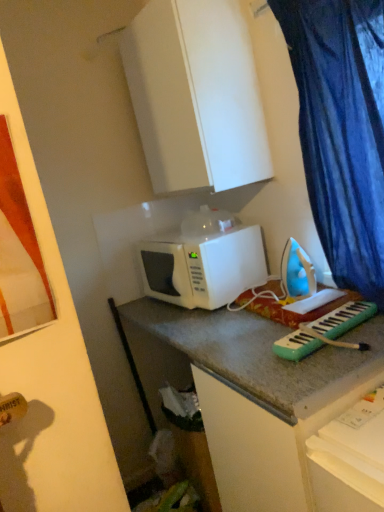
What are the coordinates of `white matte cabinet at upper center` in the screenshot? It's located at (196, 95).

This screenshot has width=384, height=512. Describe the element at coordinates (203, 267) in the screenshot. I see `white matte microwave at center` at that location.

This screenshot has width=384, height=512. Find the location of `white matte microwave at center`. white matte microwave at center is located at coordinates (203, 267).

Where is `blue fabric curtain at right`? The width and height of the screenshot is (384, 512). blue fabric curtain at right is located at coordinates (342, 130).

Locate an element on the screen. This screenshot has width=384, height=512. white matte cabinet at upper center is located at coordinates (196, 95).

Does white matte microwave at center contain blue fabric curtain at right?

No, white matte microwave at center does not contain blue fabric curtain at right.

Between white matte microwave at center and blue fabric curtain at right, which one has larger size?

With larger size is blue fabric curtain at right.

Between white matte microwave at center and blue fabric curtain at right, which one has larger width?

With larger width is white matte microwave at center.

From a real-world perspective, which is physically below, blue fabric curtain at right or white matte microwave at center?

white matte microwave at center, from a real-world perspective.

What's the angular difference between blue fabric curtain at right and white matte microwave at center's facing directions?

8.33 degrees.

Does blue fabric curtain at right have a smaller size compared to white matte microwave at center?

Actually, blue fabric curtain at right might be larger than white matte microwave at center.

Considering the sizes of objects blue fabric curtain at right and white matte microwave at center in the image provided, who is taller, blue fabric curtain at right or white matte microwave at center?

Standing taller between the two is blue fabric curtain at right.

Can you confirm if green plastic keyboard at center-right is taller than white matte cabinet at upper center?

No.

From the image's perspective, is green plastic keyboard at center-right above white matte cabinet at upper center?

Actually, green plastic keyboard at center-right appears below white matte cabinet at upper center in the image.

Locate an element on the screen. cabinetry behind the green plastic keyboard at center-right is located at coordinates coord(196,95).

Which object is thinner, white matte microwave at center or white matte cabinet at upper center?

white matte cabinet at upper center is thinner.

Which is more to the right, white matte microwave at center or white matte cabinet at upper center?

Positioned to the right is white matte microwave at center.

From a real-world perspective, is white matte microwave at center below white matte cabinet at upper center?

Indeed, from a real-world perspective, white matte microwave at center is positioned beneath white matte cabinet at upper center.

At what (x,y) coordinates should I click in order to perform the action: click on cabinetry located above the white matte microwave at center (from a real-world perspective). Please return your answer as a coordinate pair (x, y). The width and height of the screenshot is (384, 512). Looking at the image, I should click on (196, 95).

Who is bigger, white matte microwave at center or green plastic keyboard at center-right?

white matte microwave at center.

Find the location of a particular element. This screenshot has height=512, width=384. musical keyboard on the right of white matte microwave at center is located at coordinates (325, 331).

Based on the photo, is white matte microwave at center positioned with its back to green plastic keyboard at center-right?

No, white matte microwave at center's orientation is not away from green plastic keyboard at center-right.

Looking at this image, is green plastic keyboard at center-right surrounded by white matte microwave at center?

Definitely not — green plastic keyboard at center-right is not inside white matte microwave at center.

From a real-world perspective, which is physically below, white matte cabinet at upper center or blue plastic iron at center-right?

blue plastic iron at center-right is physically lower.

From the image's perspective, between white matte cabinet at upper center and blue plastic iron at center-right, who is located below?

From the image's view, blue plastic iron at center-right is below.

Does white matte cabinet at upper center turn towards blue plastic iron at center-right?

No, white matte cabinet at upper center is not facing towards blue plastic iron at center-right.

In terms of size, does blue fabric curtain at right appear bigger or smaller than green plastic keyboard at center-right?

blue fabric curtain at right is bigger than green plastic keyboard at center-right.

From the image's perspective, is blue fabric curtain at right under green plastic keyboard at center-right?

No.

Is blue fabric curtain at right positioned behind green plastic keyboard at center-right?

No, blue fabric curtain at right is closer to the viewer.

Locate an element on the screen. This screenshot has height=512, width=384. microwave oven on the left of blue fabric curtain at right is located at coordinates (203, 267).

Where is `microwave oven that is behind the blue fabric curtain at right`? microwave oven that is behind the blue fabric curtain at right is located at coordinates (203, 267).

Which object lies further to the anchor point white matte microwave at center, green plastic keyboard at center-right or white matte cabinet at upper center?

Among the two, green plastic keyboard at center-right is located further to white matte microwave at center.

Considering their positions, is white matte cabinet at upper center positioned closer to blue plastic iron at center-right than blue fabric curtain at right?

blue fabric curtain at right.

Based on their spatial positions, is white matte cabinet at upper center or green plastic keyboard at center-right closer to blue fabric curtain at right?

white matte cabinet at upper center.

Looking at the image, which one is located closer to blue fabric curtain at right, blue plastic iron at center-right or white matte cabinet at upper center?

blue plastic iron at center-right lies closer to blue fabric curtain at right than the other object.

Estimate the real-world distances between objects in this image. Which object is further from white matte microwave at center, white matte cabinet at upper center or blue plastic iron at center-right?

white matte cabinet at upper center.

From the image, which object appears to be nearer to green plastic keyboard at center-right, white matte cabinet at upper center or blue plastic iron at center-right?

Based on the image, blue plastic iron at center-right appears to be nearer to green plastic keyboard at center-right.

Looking at this image, considering their positions, is green plastic keyboard at center-right positioned closer to blue fabric curtain at right than white matte microwave at center?

green plastic keyboard at center-right lies closer to blue fabric curtain at right than the other object.

Based on the photo, estimate the real-world distances between objects in this image. Which object is closer to white matte cabinet at upper center, white matte microwave at center or blue plastic iron at center-right?

The object closer to white matte cabinet at upper center is white matte microwave at center.

This screenshot has height=512, width=384. Find the location of `curtain between white matte cabinet at upper center and white matte microwave at center from top to bottom`. curtain between white matte cabinet at upper center and white matte microwave at center from top to bottom is located at coordinates (x=342, y=130).

In order to click on appliance between green plastic keyboard at center-right and white matte microwave at center along the z-axis in this screenshot , I will do (x=297, y=272).

Find the location of a particular element. microwave oven between white matte cabinet at upper center and green plastic keyboard at center-right from top to bottom is located at coordinates (203, 267).

Find the location of `microwave oven between white matte cabinet at upper center and blue plastic iron at center-right in the up-down direction`. microwave oven between white matte cabinet at upper center and blue plastic iron at center-right in the up-down direction is located at coordinates (203, 267).